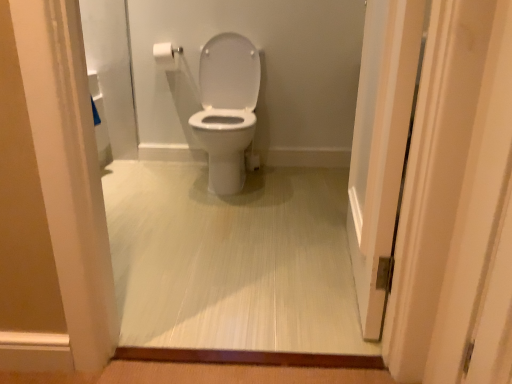
I want to click on free spot in front of white glossy toilet at center, so click(220, 213).